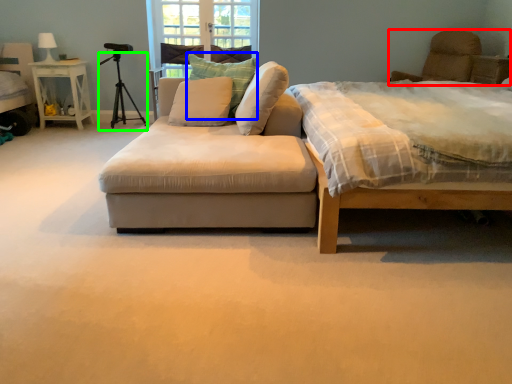
Question: Estimate the real-world distances between objects in this image. Which object is farther from swivel chair (highlighted by a red box), pillow (highlighted by a blue box) or tripod (highlighted by a green box)?

Choices:
 (A) pillow
 (B) tripod

Answer: (B)